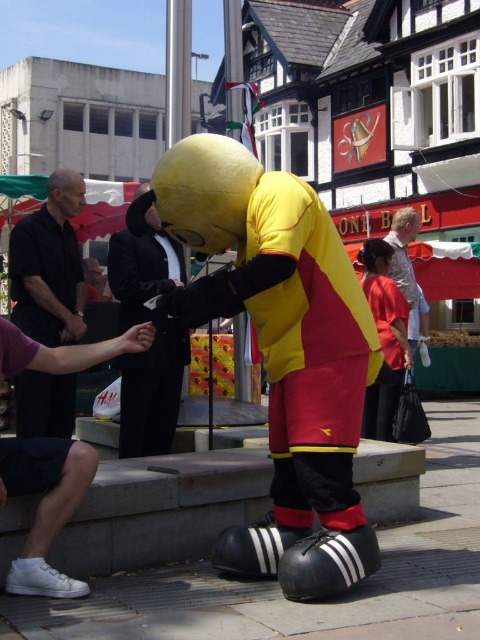
Does point (371, 401) come farther from viewer compared to point (396, 268)?

No, (371, 401) is in front of (396, 268).

Find the location of a particular element. matte yellow costume at center is located at coordinates point(385,352).

What are the coordinates of `matte yellow costume at center` in the screenshot? It's located at (385, 352).

Which of these two, white matte sneakers at lower left or matte yellow costume at center, stands taller?

Standing taller between the two is matte yellow costume at center.

Does white matte sneakers at lower left lie in front of matte yellow costume at center?

Yes, white matte sneakers at lower left is closer to the viewer.

The image size is (480, 640). I want to click on white matte sneakers at lower left, so pyautogui.click(x=45, y=506).

Identify the location of white matte sneakers at lower left. (45, 506).

Is white matte sneakers at lower left taller than light beige fabric shirt at upper right?

No.

Identify the location of white matte sneakers at lower left. pyautogui.click(x=45, y=506).

In order to click on white matte sneakers at lower left in this screenshot , I will do click(x=45, y=506).